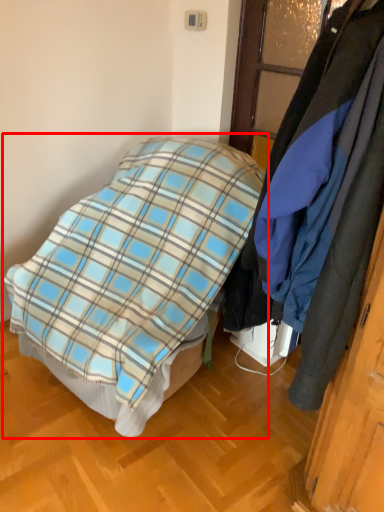
Question: In this image, where is bed (annotated by the red box) located relative to cloak?

Choices:
 (A) left
 (B) right

Answer: (A)